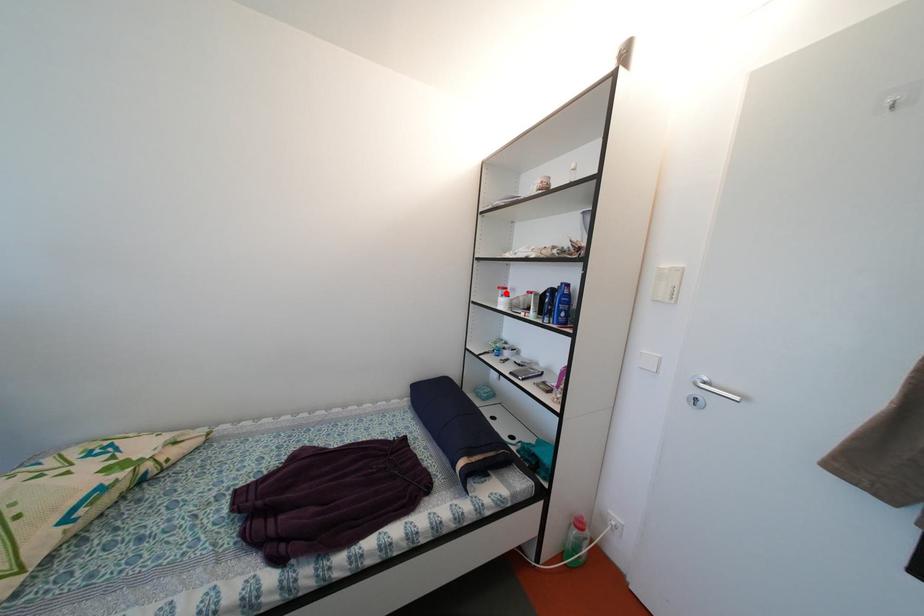
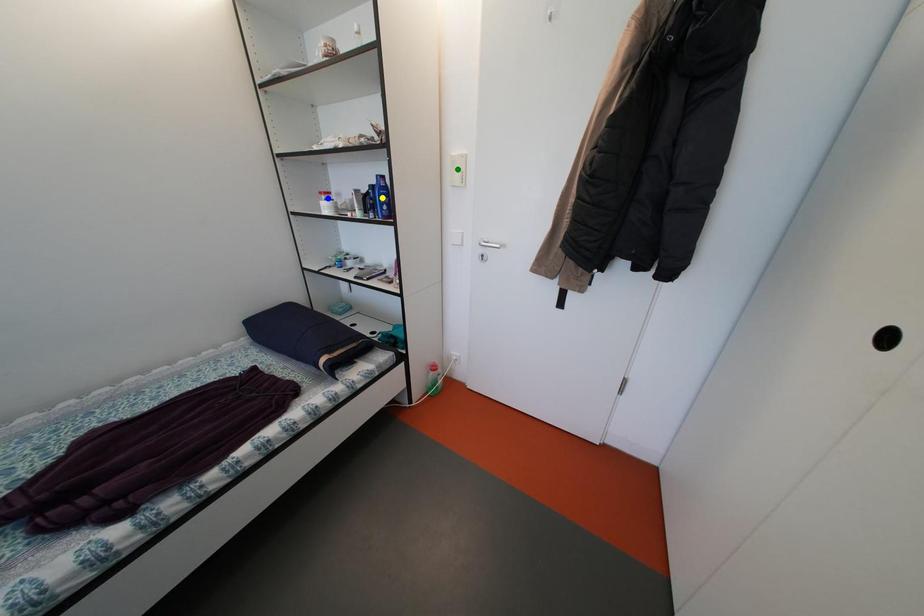
Question: I am providing you with two images of the same scene from different viewpoints. A red point is marked on the first image. You are given multiple points on the second image. Which spot in image 2 lines up with the point in image 1?

Choices:
 (A) yellow point
 (B) green point
 (C) blue point

Answer: (C)